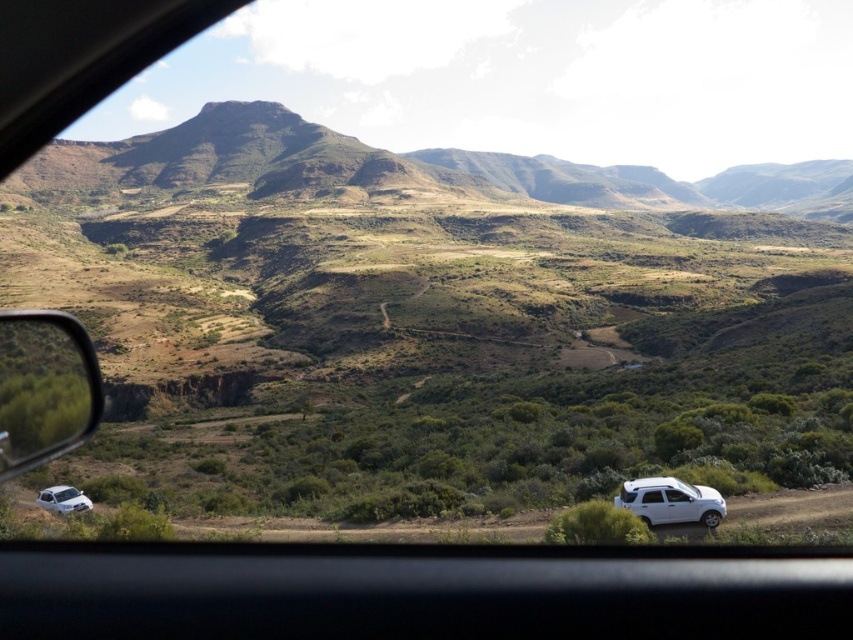
Question: Which point appears farthest from the camera in this image?

Choices:
 (A) (648, 515)
 (B) (99, 381)

Answer: (B)

Question: Does white matte suv at lower right have a smaller size compared to white matte suv at lower left?

Choices:
 (A) yes
 (B) no

Answer: (A)

Question: Where is metallic side mirror at left located in relation to white matte suv at lower left in the image?

Choices:
 (A) left
 (B) right

Answer: (A)

Question: Is metallic side mirror at left above white matte suv at lower left?

Choices:
 (A) yes
 (B) no

Answer: (A)

Question: Among these objects, which one is nearest to the camera?

Choices:
 (A) white matte suv at lower left
 (B) white matte suv at lower right

Answer: (B)

Question: Which point is farther to the camera?

Choices:
 (A) (74, 422)
 (B) (61, 492)
 (C) (619, 506)

Answer: (B)